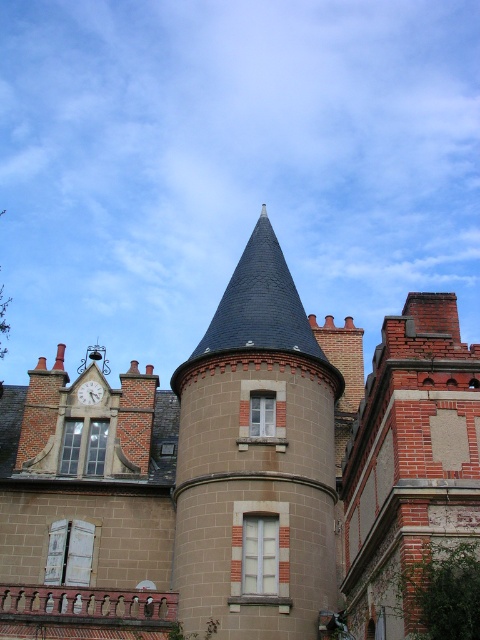
Based on the photo, between brown stone turret at center and smooth gray stone tower at center, which one is positioned higher?

Positioned higher is smooth gray stone tower at center.

What do you see at coordinates (242, 472) in the screenshot?
I see `brown stone turret at center` at bounding box center [242, 472].

Image resolution: width=480 pixels, height=640 pixels. Identify the location of brown stone turret at center. (242, 472).

Where is `brown stone turret at center`? brown stone turret at center is located at coordinates (242, 472).

Measure the distance between brown stone turret at center and white marble clock at upper left.

They are 11.18 meters apart.

Is brown stone turret at center below white marble clock at upper left?

Correct, brown stone turret at center is located below white marble clock at upper left.

Where is `brown stone turret at center`? brown stone turret at center is located at coordinates (242, 472).

Where is `brown stone turret at center`? brown stone turret at center is located at coordinates (x=242, y=472).

Is smooth gray stone tower at center below white marble clock at upper left?

No.

What do you see at coordinates (255, 460) in the screenshot? Image resolution: width=480 pixels, height=640 pixels. I see `smooth gray stone tower at center` at bounding box center [255, 460].

Locate an element on the screen. The image size is (480, 640). smooth gray stone tower at center is located at coordinates (255, 460).